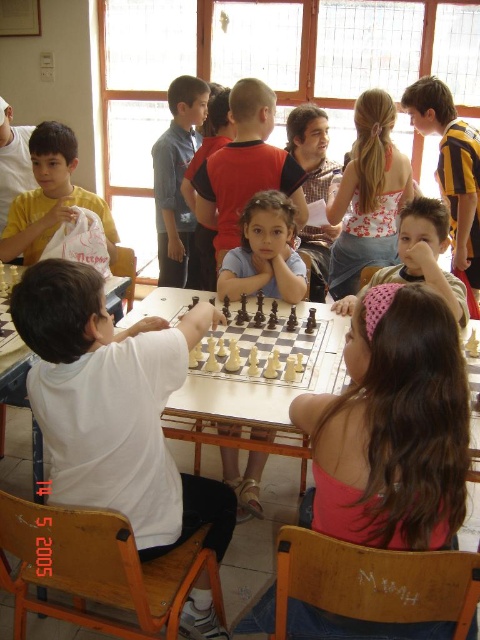
Does blue cotton shirt at center have a greater height compared to pink fabric headband at upper center?

Incorrect, blue cotton shirt at center's height is not larger of pink fabric headband at upper center's.

Between blue cotton shirt at center and pink fabric headband at upper center, which one has more height?

pink fabric headband at upper center is taller.

Describe the element at coordinates (264, 252) in the screenshot. I see `blue cotton shirt at center` at that location.

The width and height of the screenshot is (480, 640). I want to click on blue cotton shirt at center, so click(x=264, y=252).

Is point (156, 362) positioned before point (241, 218)?

Yes, point (156, 362) is in front of point (241, 218).

Can you confirm if white matte shirt at center is taller than blue cotton shirt at center?

Correct, white matte shirt at center is much taller as blue cotton shirt at center.

Identify the location of white matte shirt at center. The width and height of the screenshot is (480, 640). (115, 406).

Locate an element on the screen. white matte shirt at center is located at coordinates (115, 406).

Which is below, white matte shirt at center or white plastic chess set at center?

white matte shirt at center is lower down.

This screenshot has width=480, height=640. Find the location of `white matte shirt at center`. white matte shirt at center is located at coordinates (115, 406).

Measure the distance between white matte shirt at center and camera.

white matte shirt at center is 4.00 feet away from camera.

This screenshot has width=480, height=640. Identify the location of white matte shirt at center. (115, 406).